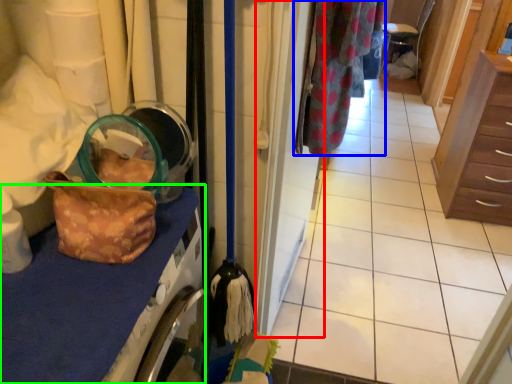
Question: Considering the real-world distances, which object is farthest from door (highlighted by a red box)? clothing (highlighted by a blue box) or counter top (highlighted by a green box)?

Choices:
 (A) clothing
 (B) counter top

Answer: (B)